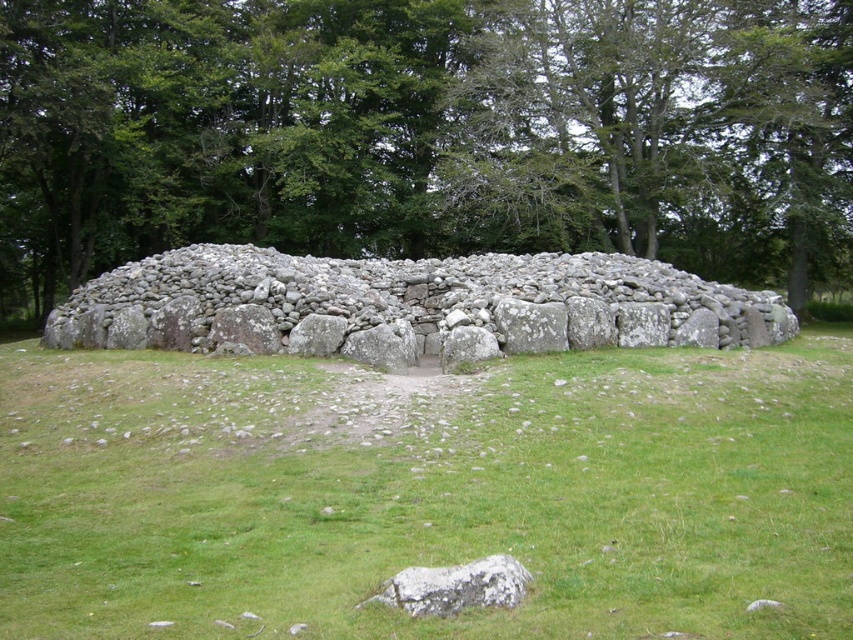
You are standing at the center of the ancient stone structure. Looking out towards the grassy field, you notice a point marked at coordinates (425, 132). What object is located at that specific coordinate?

The point at coordinates (425, 132) is where the green leafy tree at upper center is located.

You are standing at the base of the gray rough rock at lower center and want to find the green leafy tree at upper center. In which direction should you look?

The green leafy tree at upper center is to the left of gray rough rock at lower center, so you should look to your left to find it.

You are a hiker standing in the field near the ancient stone structure. You notice the green leafy tree at upper center and the gray stone wall at center. Which object has a greater width?

The green leafy tree at upper center has a greater width than the gray stone wall at center.